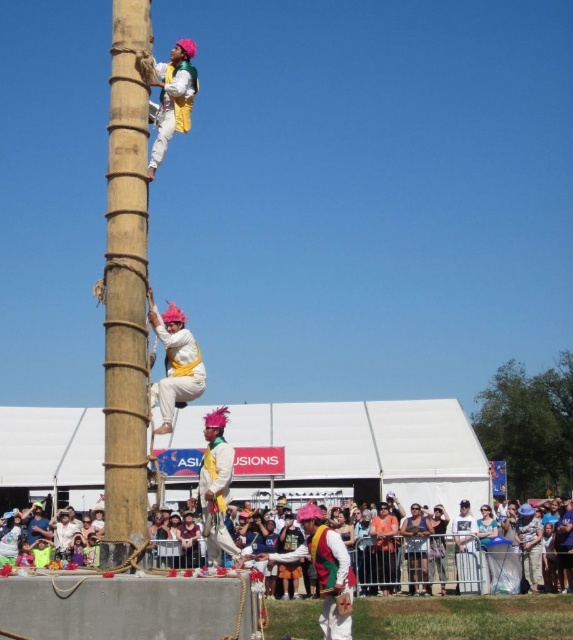
Question: Is matte yellow fabric at center further to the viewer compared to matte yellow fabric at upper center?

Choices:
 (A) no
 (B) yes

Answer: (A)

Question: Estimate the real-world distances between objects in this image. Which object is closer to the matte yellow fabric at center?

Choices:
 (A) multicolored fabric crowd at lower center
 (B) natural wood pole at center

Answer: (B)

Question: Is natural wood pole at center above multicolored fabric crowd at lower center?

Choices:
 (A) no
 (B) yes

Answer: (B)

Question: Which of the following is the farthest from the observer?

Choices:
 (A) natural wood pole at center
 (B) matte yellow fabric at upper center
 (C) matte yellow fabric at center

Answer: (B)

Question: Which of the following is the closest to the observer?

Choices:
 (A) natural wood pole at center
 (B) matte yellow fabric at center
 (C) matte yellow fabric at upper center
 (D) multicolored fabric crowd at lower center

Answer: (D)

Question: Is natural wood pole at center in front of matte yellow fabric at upper center?

Choices:
 (A) yes
 (B) no

Answer: (A)